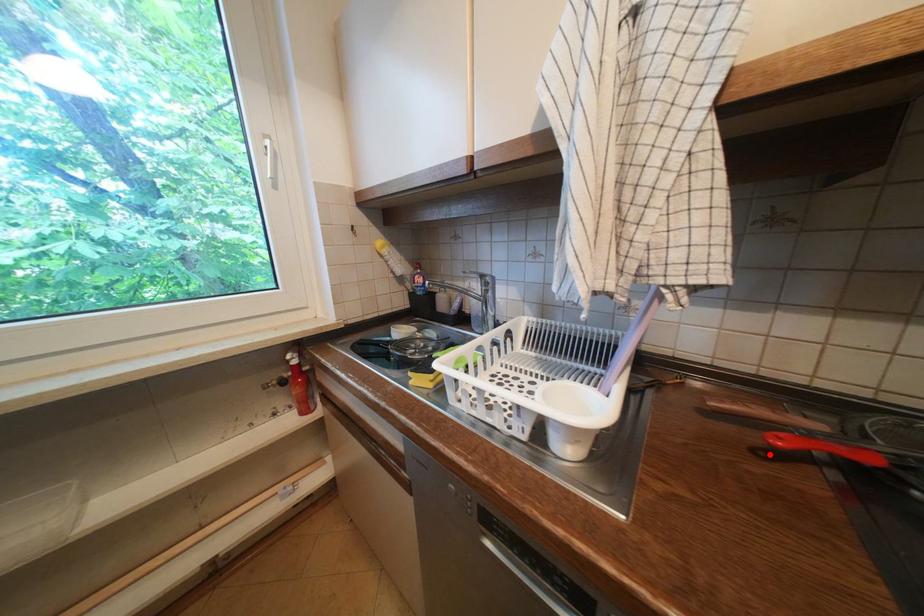
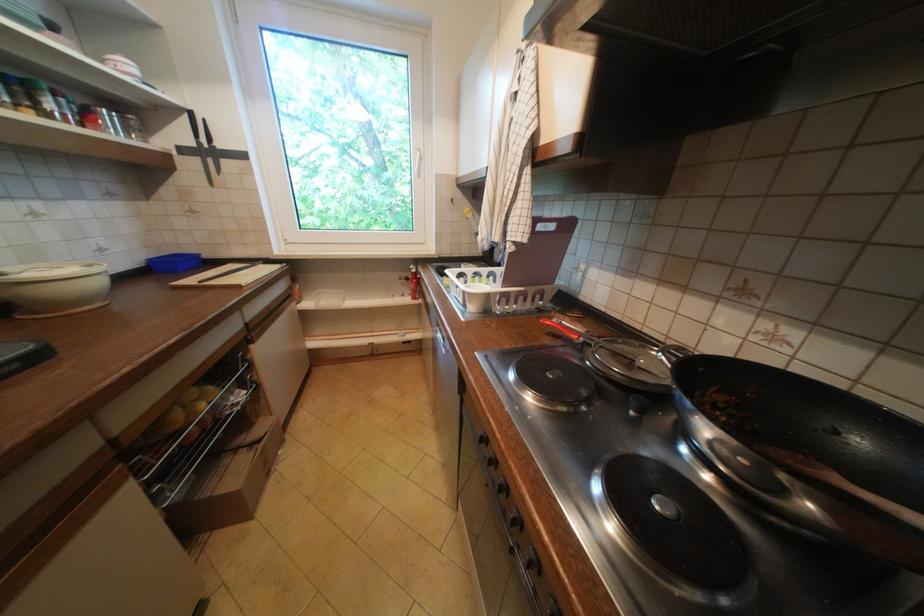
Locate, in the second image, the point that corresponds to the highlighted location in the first image.

(558, 334)